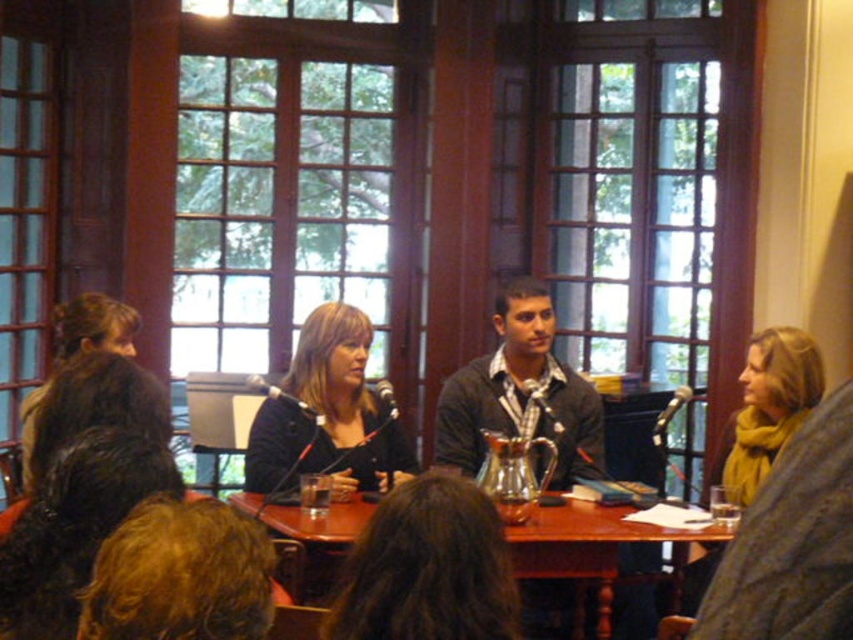
You are standing at the point labeled as point (489, 630) in the image. If you want to move towards the viewer, which direction should you go?

Since the point (489, 630) and the viewer are 2.10 meters apart, you would need to move towards the viewer by going in the direction away from the table and towards the entrance of the room.